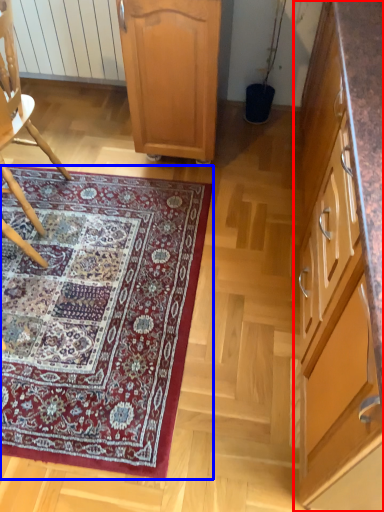
Question: Which object is further to the camera taking this photo, cabinetry (highlighted by a red box) or mat (highlighted by a blue box)?

Choices:
 (A) cabinetry
 (B) mat

Answer: (B)